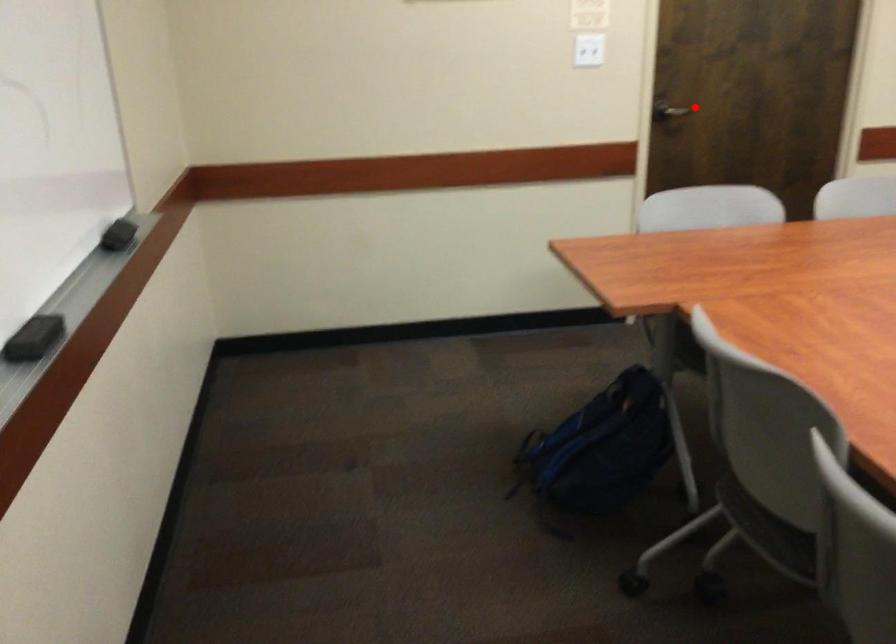
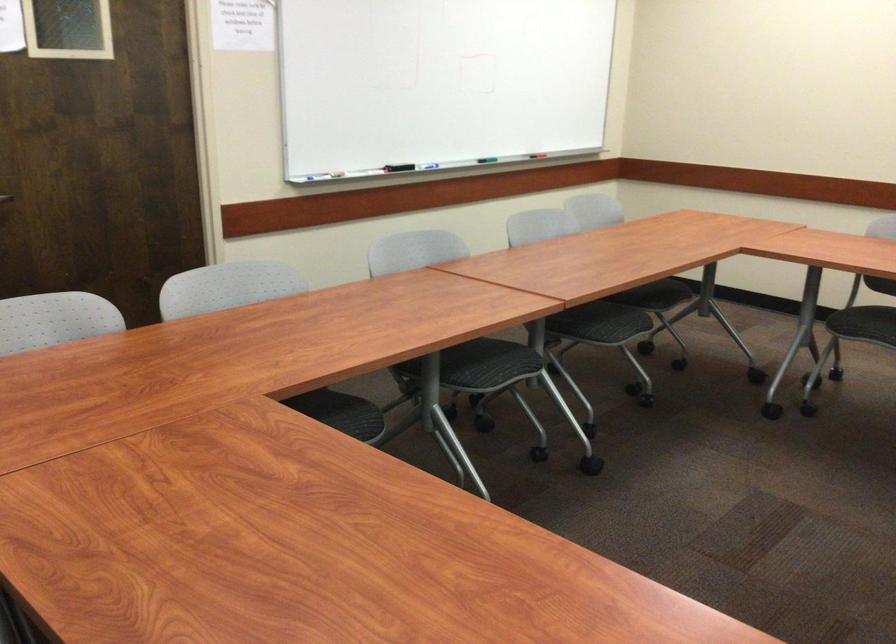
Question: I am providing you with two images of the same scene from different viewpoints. Image1 has a red point marked. In image2, the corresponding 3D location appears at what relative position? Reply with the corresponding letter.

Choices:
 (A) Closer
 (B) Farther

Answer: (A)